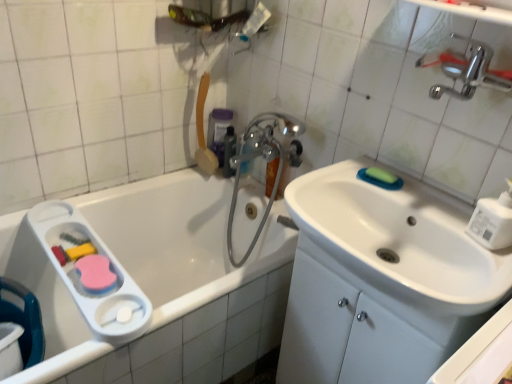
You are a GUI agent. You are given a task and a screenshot of the screen. Output one action in this format:
    pyautogui.click(x=<x>, y=<y>)
    Task: Click on the free space to the back side of white plastic soap dispenser at right
    The height and width of the screenshot is (384, 512).
    Given the screenshot: What is the action you would take?
    pyautogui.click(x=439, y=206)